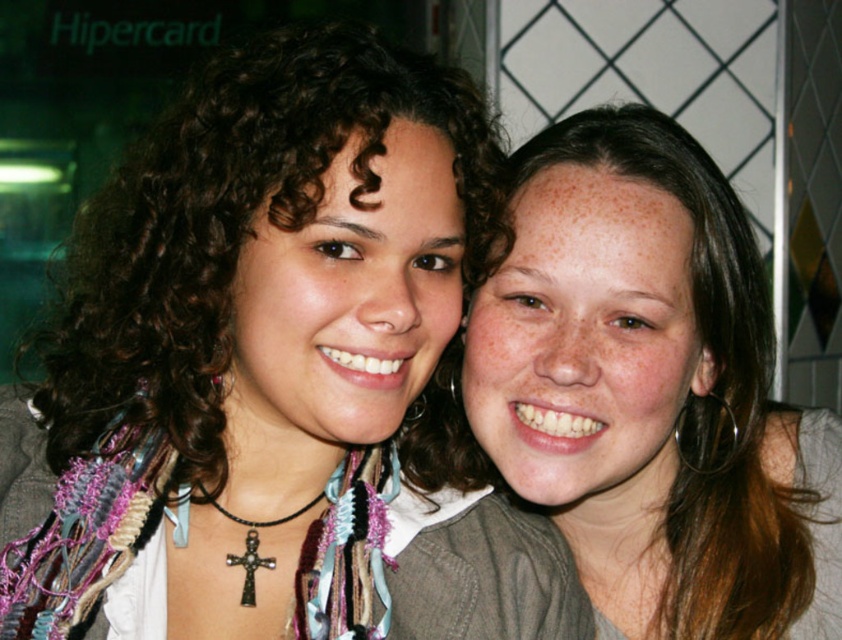
You are taking a photo of two people standing side by side. You notice the light brown hair at center and the black metallic cross at center. Which object is positioned higher in the image?

The light brown hair at center is positioned higher than the black metallic cross at center in the image.

You are standing in front of the photograph and want to place a small sticker on the point that is closer to you. Which point should you choose between the point at coordinates point (x=62, y=413) and the point at coordinates point (x=739, y=224)?

You should choose point (x=62, y=413) because it is closer to the viewer than point (x=739, y=224).